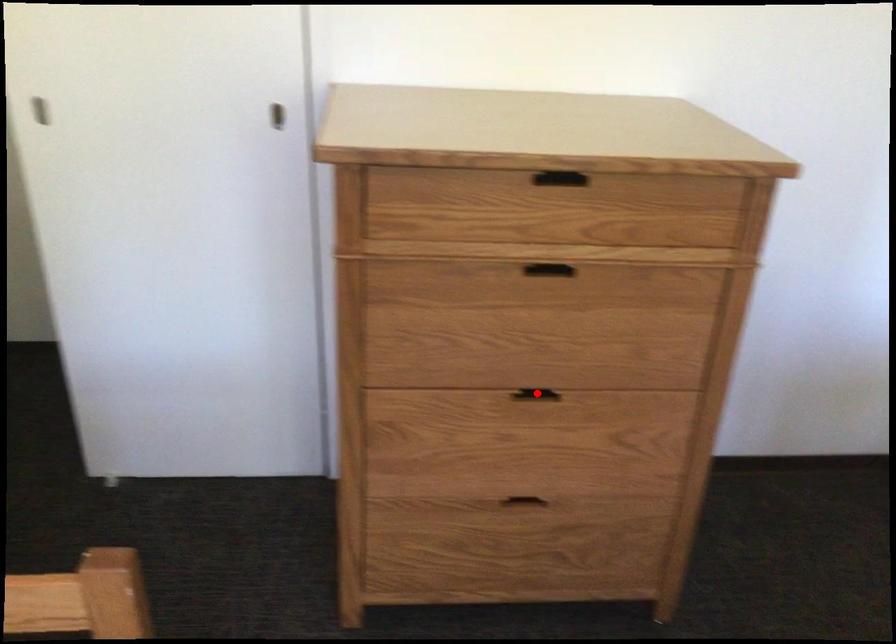
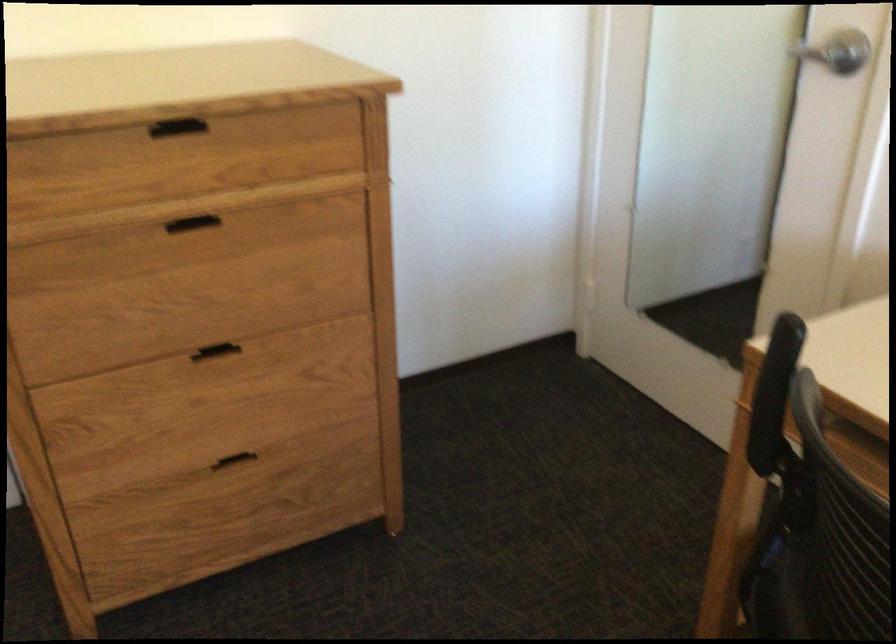
In the second image, find the point that corresponds to the highlighted location in the first image.

(214, 352)